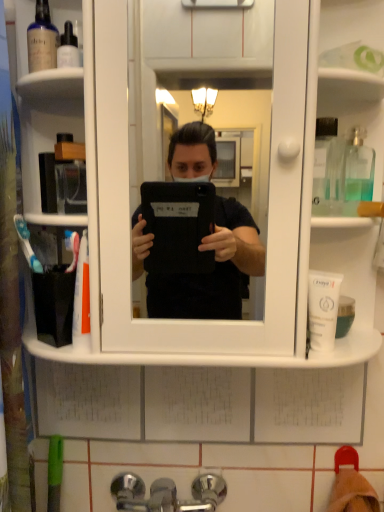
Question: From a real-world perspective, is white plastic cabinet at center located higher than white matte tube at right, marked as the 1th mouthwash in a bottom-to-top arrangement?

Choices:
 (A) no
 (B) yes

Answer: (B)

Question: Considering the relative sizes of white plastic cabinet at center and white matte tube at right, marked as the 1th mouthwash in a bottom-to-top arrangement, in the image provided, is white plastic cabinet at center shorter than white matte tube at right, marked as the 1th mouthwash in a bottom-to-top arrangement,?

Choices:
 (A) yes
 (B) no

Answer: (B)

Question: Is white plastic cabinet at center facing towards white matte tube at right, which appears as the 2th mouthwash when viewed from the right?

Choices:
 (A) yes
 (B) no

Answer: (A)

Question: From the image's perspective, is white plastic cabinet at center under white matte tube at right, acting as the 2th mouthwash starting from the left?

Choices:
 (A) no
 (B) yes

Answer: (A)

Question: Can you confirm if white plastic cabinet at center is positioned to the left of white matte tube at right, which appears as the 2th mouthwash when viewed from the right?

Choices:
 (A) yes
 (B) no

Answer: (A)

Question: From the image's perspective, is white plastic cabinet at center on white matte tube at right, the third mouthwash positioned from the top?

Choices:
 (A) no
 (B) yes

Answer: (B)

Question: Is clear glass bottle at upper right, marked as the 1th mouthwash in a right-to-left arrangement, located outside white matte tube at right, which appears as the 2th mouthwash when viewed from the right?

Choices:
 (A) no
 (B) yes

Answer: (B)

Question: Can you confirm if clear glass bottle at upper right, marked as the 1th mouthwash in a right-to-left arrangement, is bigger than white matte tube at right, the third mouthwash positioned from the top?

Choices:
 (A) yes
 (B) no

Answer: (B)

Question: Could you tell me if clear glass bottle at upper right, which appears as the second mouthwash when viewed from the top, is facing white matte tube at right, the third mouthwash positioned from the top?

Choices:
 (A) yes
 (B) no

Answer: (B)

Question: Is clear glass bottle at upper right, the 3th mouthwash viewed from the left, next to white matte tube at right, the third mouthwash positioned from the top, and touching it?

Choices:
 (A) yes
 (B) no

Answer: (B)

Question: From a real-world perspective, is clear glass bottle at upper right, which appears as the second mouthwash when viewed from the top, physically above white matte tube at right, acting as the 2th mouthwash starting from the left?

Choices:
 (A) no
 (B) yes

Answer: (B)

Question: Can you confirm if clear glass bottle at upper right, the second mouthwash in the bottom-to-top sequence, is positioned to the left of white matte tube at right, acting as the 2th mouthwash starting from the left?

Choices:
 (A) no
 (B) yes

Answer: (A)

Question: Could you tell me if clear glass bottle at upper right, the second mouthwash in the bottom-to-top sequence, is facing chrome metallic faucet at lower center?

Choices:
 (A) yes
 (B) no

Answer: (B)